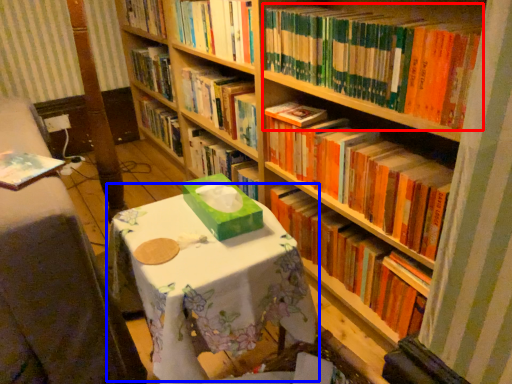
Question: Which object appears farthest to the camera in this image, book (highlighted by a red box) or round table (highlighted by a blue box)?

Choices:
 (A) book
 (B) round table

Answer: (A)